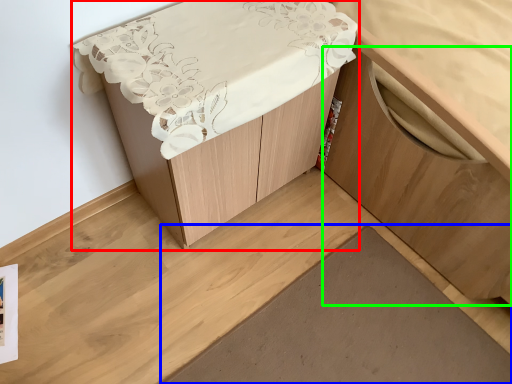
Question: Which object is positioned closest to furniture (highlighted by a red box)? Select from plank (highlighted by a blue box) and cabinetry (highlighted by a green box).

Choices:
 (A) plank
 (B) cabinetry

Answer: (B)